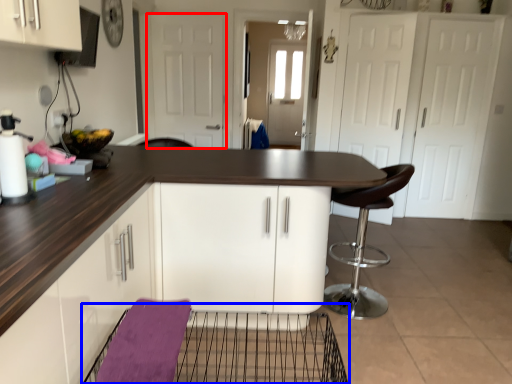
Question: Which object appears closest to the camera in this image, door (highlighted by a red box) or cage (highlighted by a blue box)?

Choices:
 (A) door
 (B) cage

Answer: (B)